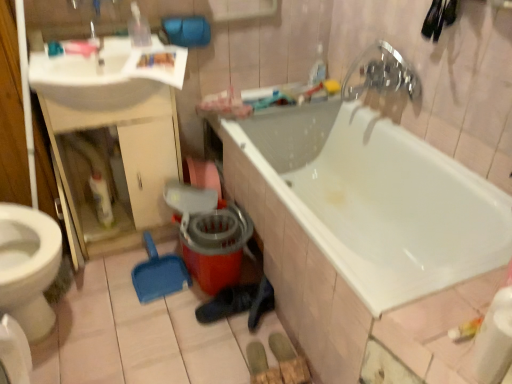
Question: Is white glossy bathtub at center to the left or to the right of chrome metallic faucet at upper right in the image?

Choices:
 (A) right
 (B) left

Answer: (B)

Question: Looking at the image, does white glossy bathtub at center seem bigger or smaller compared to chrome metallic faucet at upper right?

Choices:
 (A) big
 (B) small

Answer: (A)

Question: Which object is positioned farthest from the chrome metallic faucet at upper right?

Choices:
 (A) white glossy bottle at left
 (B) white glossy sink at upper left
 (C) white glossy bathtub at center

Answer: (A)

Question: Which of these objects is positioned closest to the white glossy bottle at left?

Choices:
 (A) white glossy bathtub at center
 (B) white glossy sink at upper left
 (C) chrome metallic faucet at upper right

Answer: (B)